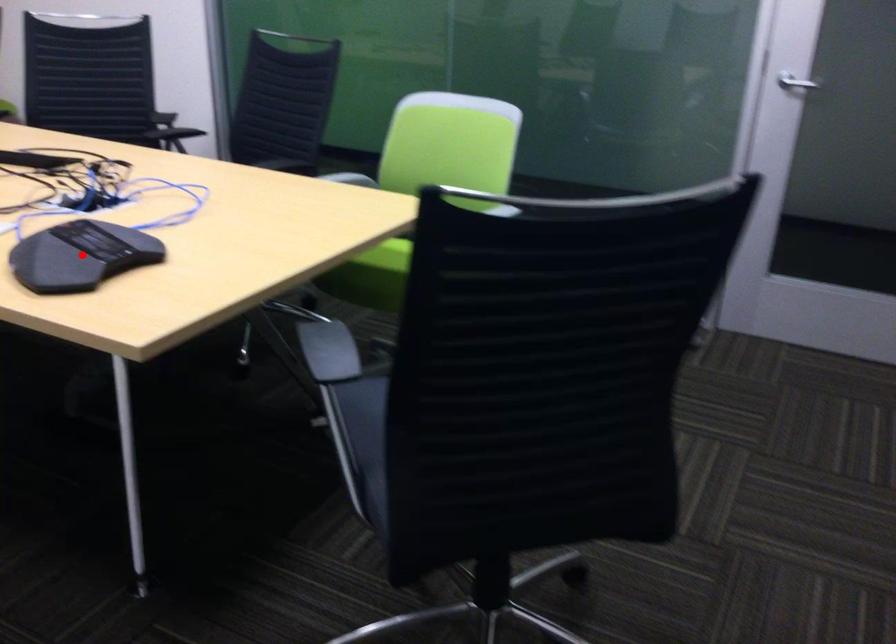
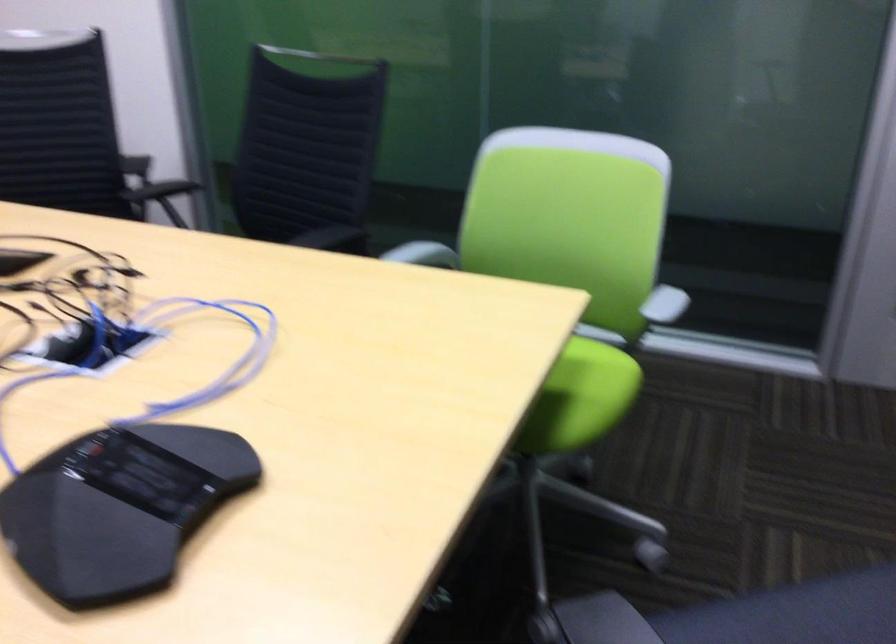
Question: I am providing you with two images of the same scene from different viewpoints. A red point is shown in image1. For the corresponding object point in image2, is it positioned nearer or farther from the camera?

Choices:
 (A) Nearer
 (B) Farther

Answer: (A)